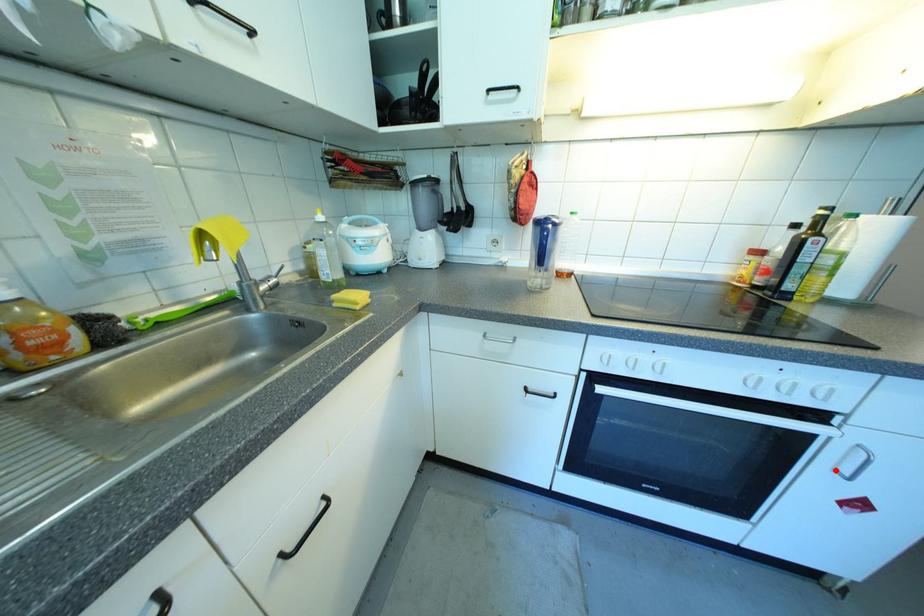
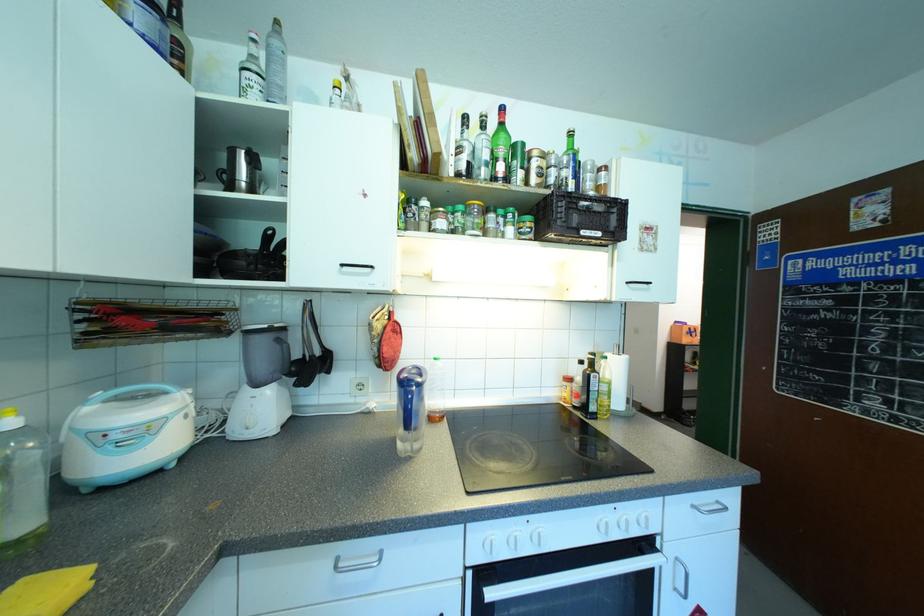
Question: I am providing you with two images of the same scene from different viewpoints. Given a red point in image1, look at the same physical point in image2. Is it:

Choices:
 (A) Closer to the viewpoint
 (B) Farther from the viewpoint

Answer: (A)